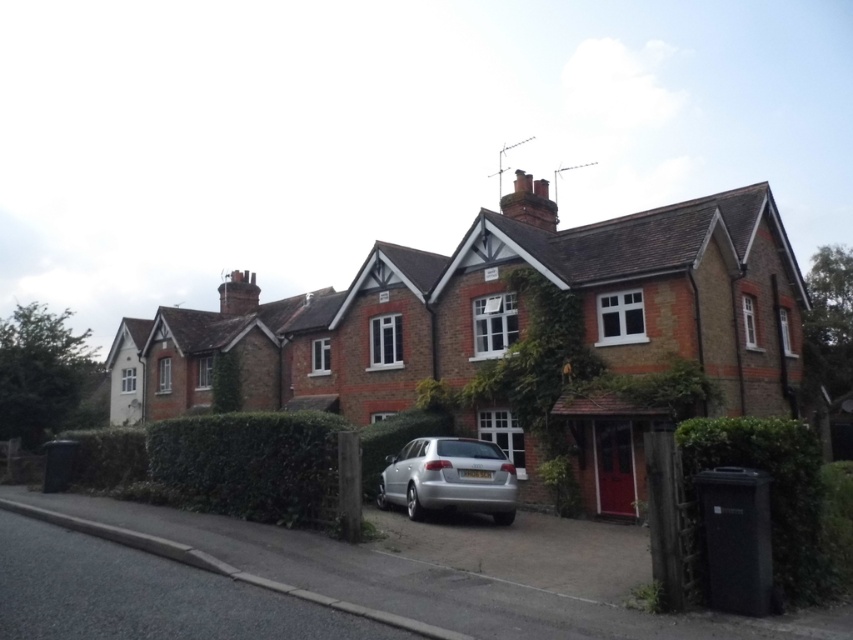
Does point (795, 465) lie behind point (456, 490)?

No, it is not.

Does point (744, 438) come farther from viewer compared to point (454, 506)?

No, it is not.

Find the location of a particular element. The height and width of the screenshot is (640, 853). green leafy hedge at lower right is located at coordinates [x=772, y=486].

Who is shorter, green leafy hedge at lower left or silver metallic car at center?

With less height is silver metallic car at center.

Who is more distant from viewer, (305, 442) or (437, 492)?

Point (437, 492)

Find the location of a particular element. The image size is (853, 640). green leafy hedge at lower left is located at coordinates (250, 465).

Is green leafy hedge at lower left bigger than green leafy hedge at lower right?

No.

Is point (289, 520) positioned after point (814, 497)?

Yes.

I want to click on green leafy hedge at lower left, so click(x=250, y=465).